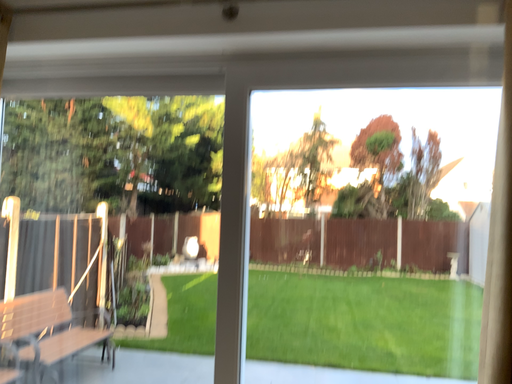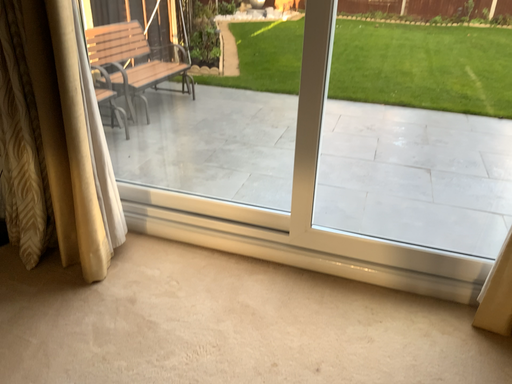
Question: Which way did the camera rotate in the video?

Choices:
 (A) rotated left
 (B) rotated right

Answer: (A)